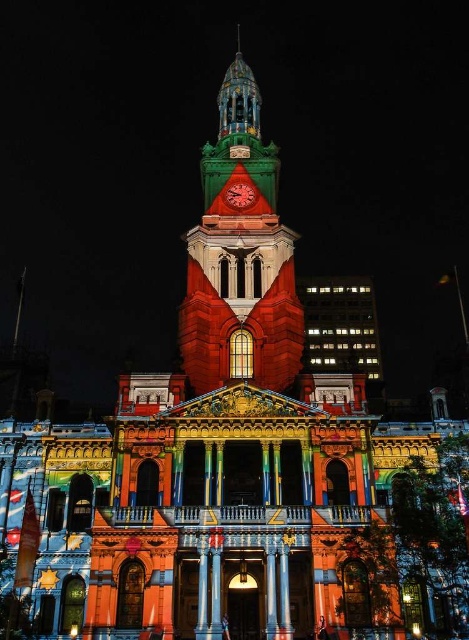
Question: Among these objects, which one is farthest from the camera?

Choices:
 (A) green stone clock tower at center
 (B) metallic clock at center

Answer: (B)

Question: Considering the relative positions of green stone clock tower at center and metallic clock at center in the image provided, where is green stone clock tower at center located with respect to metallic clock at center?

Choices:
 (A) below
 (B) above

Answer: (B)

Question: Is green stone clock tower at center further to the viewer compared to metallic clock at center?

Choices:
 (A) no
 (B) yes

Answer: (A)

Question: Does green stone clock tower at center appear under metallic clock at center?

Choices:
 (A) yes
 (B) no

Answer: (B)